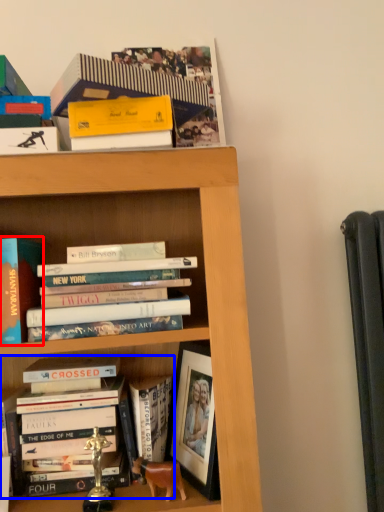
Question: Which point is further to the camera, book (highlighted by a red box) or book (highlighted by a blue box)?

Choices:
 (A) book
 (B) book

Answer: (B)